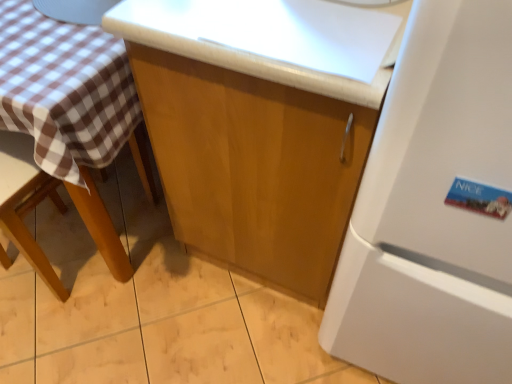
Locate an element on the screen. Image resolution: width=512 pixels, height=384 pixels. vacant area that lies to the right of brown wooden chair at left is located at coordinates (138, 260).